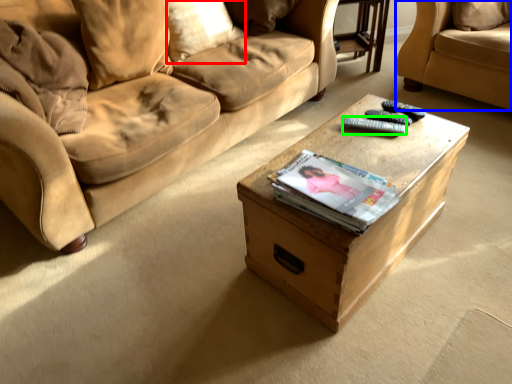
Question: Which object is positioned closest to pillow (highlighted by a red box)? Select from studio couch (highlighted by a blue box) and remote (highlighted by a green box).

Choices:
 (A) studio couch
 (B) remote

Answer: (B)